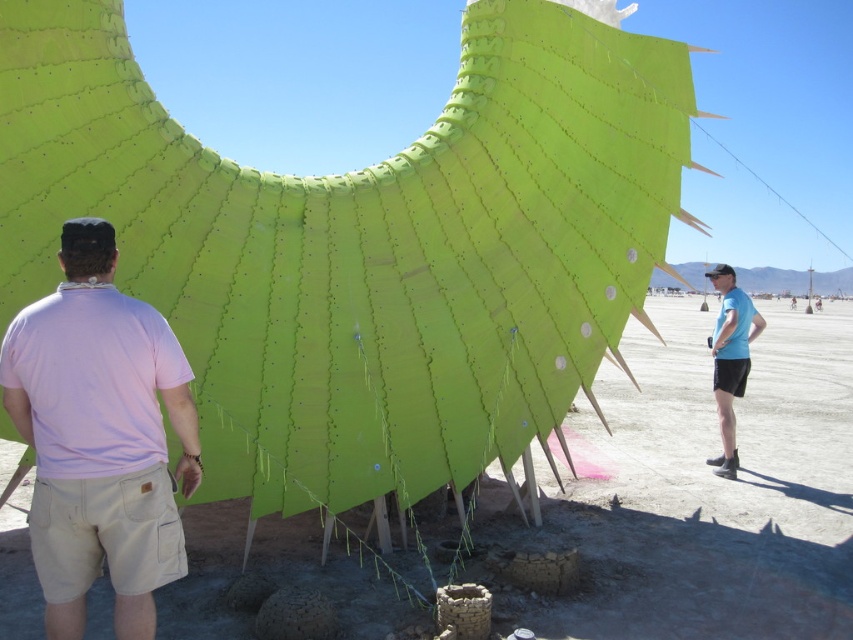
Is pink cotton shirt at left above blue fabric shirt at right?

No.

Is pink cotton shirt at left shorter than blue fabric shirt at right?

Yes.

The width and height of the screenshot is (853, 640). In order to click on pink cotton shirt at left in this screenshot , I will do `click(99, 436)`.